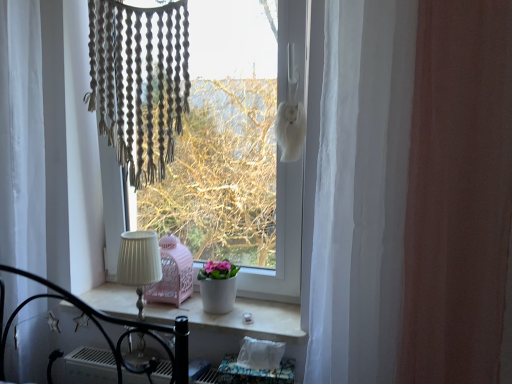
You are a GUI agent. You are given a task and a screenshot of the screen. Output one action in this format:
    pyautogui.click(x=<x>, y=<y>)
    Task: Click on the white matte window at center
    This screenshot has height=384, width=512.
    Given the screenshot: What is the action you would take?
    pyautogui.click(x=243, y=162)

What do you see at coordinates (243, 162) in the screenshot? I see `white matte window at center` at bounding box center [243, 162].

Describe the element at coordinates (361, 191) in the screenshot. The width and height of the screenshot is (512, 384). I see `white sheer curtain at right, which appears as the first curtain when viewed from the front` at that location.

What do you see at coordinates (139, 263) in the screenshot? I see `white pleated fabric at center` at bounding box center [139, 263].

Consider the image. Measure the distance between white sheer curtain at left, the 1th curtain viewed from the back, and camera.

white sheer curtain at left, the 1th curtain viewed from the back, is 1.29 meters away from camera.

Locate an element on the screen. This screenshot has width=512, height=384. white matte window at center is located at coordinates (243, 162).

From a real-world perspective, is white ceramic window sill at center on white matte window at center?

Actually, white ceramic window sill at center is physically below white matte window at center in the real world.

Can you confirm if white ceramic window sill at center is positioned to the right of white matte window at center?

Incorrect, white ceramic window sill at center is not on the right side of white matte window at center.

Considering the relative sizes of white ceramic window sill at center and white matte window at center in the image provided, is white ceramic window sill at center shorter than white matte window at center?

Yes, white ceramic window sill at center is shorter than white matte window at center.

Is white sheer curtain at right, which appears as the 2th curtain when viewed from the left, next to white pleated fabric at center and touching it?

No.

What's the angular difference between white sheer curtain at right, which is the first curtain in right-to-left order, and white pleated fabric at center's facing directions?

They differ by 0.00115 degrees in their facing directions.

From the image's perspective, which object appears higher, white sheer curtain at right, which appears as the first curtain when viewed from the front, or white pleated fabric at center?

white sheer curtain at right, which appears as the first curtain when viewed from the front, appears higher in the image.

Is white sheer curtain at right, which is counted as the 2th curtain, starting from the back, closer to camera compared to white pleated fabric at center?

Yes, white sheer curtain at right, which is counted as the 2th curtain, starting from the back, is closer to the viewer.

From the image's perspective, between white sheer curtain at right, which is counted as the 2th curtain, starting from the back, and white ceramic window sill at center, who is located below?

white ceramic window sill at center.

Does point (413, 43) appear closer or farther from the camera than point (191, 313)?

Point (413, 43) appears to be closer to the viewer than point (191, 313).

Which is closer to the camera, (275, 240) or (216, 290)?

The point (216, 290) is closer.

Considering the relative sizes of white matte window at center and white matte pot at center in the image provided, is white matte window at center bigger than white matte pot at center?

Indeed, white matte window at center has a larger size compared to white matte pot at center.

Can you confirm if white matte window at center is taller than white matte pot at center?

Yes.

Does white matte pot at center lie in front of white sheer curtain at left, the 2th curtain from the front?

No, the depth of white matte pot at center is greater than that of white sheer curtain at left, the 2th curtain from the front.

Between white matte pot at center and white sheer curtain at left, the 1th curtain viewed from the back, which one has smaller size?

white matte pot at center is smaller.

Identify the location of houseplant located behind the white sheer curtain at left, the second curtain when ordered from right to left. (218, 286).

Is white matte pot at center at the right side of white sheer curtain at left, the 2th curtain from the front?

Yes, white matte pot at center is to the right of white sheer curtain at left, the 2th curtain from the front.

Is white matte pot at center not close to white matte window at center?

No, white matte pot at center is in close proximity to white matte window at center.

Between white matte pot at center and white matte window at center, which one is positioned behind?

white matte pot at center is further from the camera.

Can you tell me how much white matte pot at center and white matte window at center differ in facing direction?

There is a 0.000281-degree angle between the facing directions of white matte pot at center and white matte window at center.

Is point (229, 272) closer or farther from the camera than point (115, 93)?

Clearly, point (229, 272) is more distant from the camera than point (115, 93).

Considering the relative sizes of white sheer curtain at right, which is the first curtain in right-to-left order, and white sheer curtain at left, the 1th curtain viewed from the back, in the image provided, is white sheer curtain at right, which is the first curtain in right-to-left order, thinner than white sheer curtain at left, the 1th curtain viewed from the back,?

Incorrect, the width of white sheer curtain at right, which is the first curtain in right-to-left order, is not less than that of white sheer curtain at left, the 1th curtain viewed from the back.

Which of these two, white sheer curtain at right, which appears as the 2th curtain when viewed from the left, or white sheer curtain at left, the 1th curtain viewed from the back, stands shorter?

Standing shorter between the two is white sheer curtain at right, which appears as the 2th curtain when viewed from the left.

Would you say white sheer curtain at right, which appears as the 2th curtain when viewed from the left, is outside white sheer curtain at left, the 2th curtain from the front?

Indeed, white sheer curtain at right, which appears as the 2th curtain when viewed from the left, is completely outside white sheer curtain at left, the 2th curtain from the front.

Is white sheer curtain at right, which is the first curtain in right-to-left order, turned away from white sheer curtain at left, the 1th curtain viewed from the back?

white sheer curtain at right, which is the first curtain in right-to-left order, does not have its back to white sheer curtain at left, the 1th curtain viewed from the back.

The height and width of the screenshot is (384, 512). Find the location of `window sill on the left side of white matte window at center`. window sill on the left side of white matte window at center is located at coordinates (236, 318).

The height and width of the screenshot is (384, 512). I want to click on the 1st curtain above the white pleated fabric at center (from the image's perspective), so click(x=361, y=191).

Considering their positions, is white ceramic window sill at center positioned closer to white sheer curtain at right, which appears as the 2th curtain when viewed from the left, than white matte window at center?

The object closer to white sheer curtain at right, which appears as the 2th curtain when viewed from the left, is white ceramic window sill at center.

Looking at the image, which one is located further to white matte window at center, white ceramic window sill at center or white pleated fabric at center?

white pleated fabric at center lies further to white matte window at center than the other object.

Based on their spatial positions, is white pleated fabric at center or white sheer curtain at left, the 2th curtain from the front, closer to white sheer curtain at right, which is the first curtain in right-to-left order?

Based on the image, white pleated fabric at center appears to be nearer to white sheer curtain at right, which is the first curtain in right-to-left order.

Estimate the real-world distances between objects in this image. Which object is closer to white matte window at center, white sheer curtain at left, the second curtain when ordered from right to left, or white ceramic window sill at center?

white ceramic window sill at center is closer to white matte window at center.

Based on the photo, considering their positions, is white ceramic window sill at center positioned further to white matte window at center than white sheer curtain at right, which appears as the 2th curtain when viewed from the left?

white sheer curtain at right, which appears as the 2th curtain when viewed from the left, is further to white matte window at center.

Based on their spatial positions, is white ceramic window sill at center or white matte pot at center further from white sheer curtain at left, the 1th curtain when ordered from left to right?

Based on the image, white matte pot at center appears to be further to white sheer curtain at left, the 1th curtain when ordered from left to right.

When comparing their distances from white matte window at center, does white sheer curtain at right, which appears as the 2th curtain when viewed from the left, or white ceramic window sill at center seem closer?

The object closer to white matte window at center is white ceramic window sill at center.

Looking at the image, which one is located closer to white sheer curtain at right, which is counted as the 2th curtain, starting from the back, white ceramic window sill at center or white matte pot at center?

Based on the image, white ceramic window sill at center appears to be nearer to white sheer curtain at right, which is counted as the 2th curtain, starting from the back.

You are a GUI agent. You are given a task and a screenshot of the screen. Output one action in this format:
    pyautogui.click(x=<x>, y=<y>)
    Task: Click on the table lamp between white sheer curtain at left, the 1th curtain when ordered from left to right, and white sheer curtain at right, which appears as the first curtain when viewed from the front
    
    Given the screenshot: What is the action you would take?
    pyautogui.click(x=139, y=263)

Identify the location of houseplant situated between white pleated fabric at center and white sheer curtain at right, which appears as the 2th curtain when viewed from the left, from left to right. (218, 286).

Locate an element on the screen. houseplant between white matte window at center and white sheer curtain at right, which appears as the 2th curtain when viewed from the left is located at coordinates (218, 286).

This screenshot has height=384, width=512. In order to click on table lamp between white sheer curtain at left, the 2th curtain from the front, and white ceramic window sill at center, in the horizontal direction in this screenshot , I will do `click(139, 263)`.